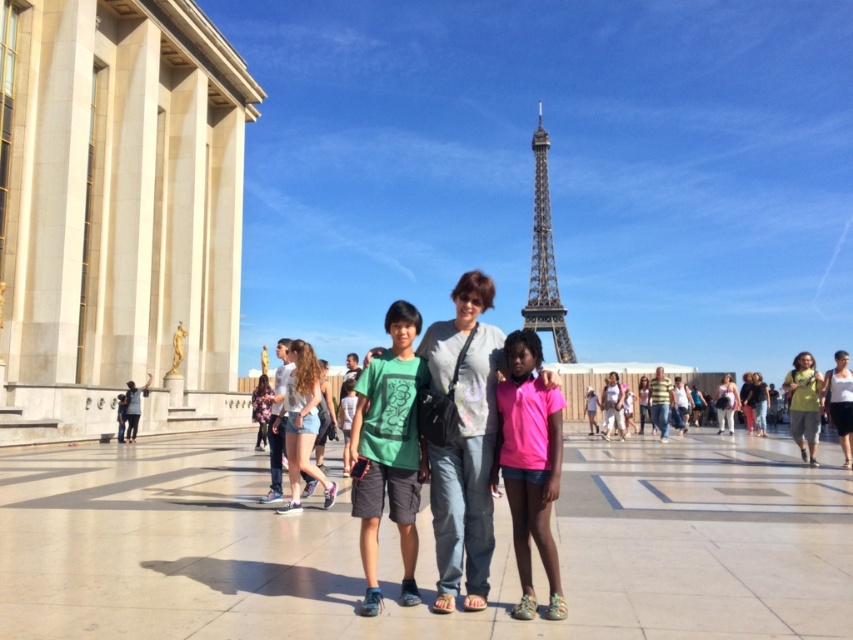
You are a photographer at the Trocadadero Square in Paris, and you want to ensure that the striped cotton shirt at right and the light blue denim jeans at center are visible in your photo. Given their sizes, which object might require you to adjust your camera angle to include it fully?

The striped cotton shirt at right has a larger width than the light blue denim jeans at center, so you might need to adjust your camera angle to ensure the striped cotton shirt at right is fully visible.

You are a photographer trying to frame a group photo of the pink fabric shirt at lower right and the striped cotton shirt at right. Which of the two shirts has a larger width?

The pink fabric shirt at lower right has a larger width than the striped cotton shirt at right.